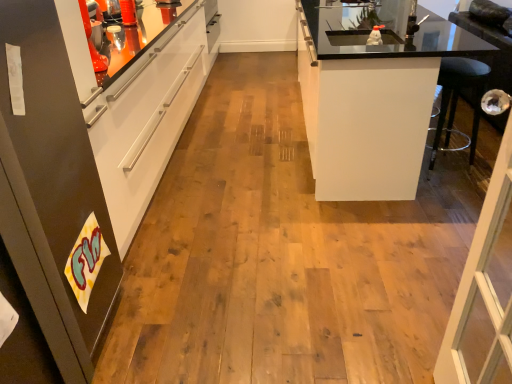
Question: From the image's perspective, would you say matte black refrigerator at left, arranged as the second cabinetry when viewed from the right, is shown under white glossy cabinet at right, the second cabinetry from the front?

Choices:
 (A) yes
 (B) no

Answer: (A)

Question: Does matte black refrigerator at left, arranged as the first cabinetry when viewed from the front, turn towards white glossy cabinet at right, which is the second cabinetry in left-to-right order?

Choices:
 (A) no
 (B) yes

Answer: (A)

Question: Is matte black refrigerator at left, arranged as the first cabinetry when viewed from the front, to the right of white glossy cabinet at right, the second cabinetry from the front, from the viewer's perspective?

Choices:
 (A) yes
 (B) no

Answer: (B)

Question: Can you confirm if matte black refrigerator at left, arranged as the second cabinetry when viewed from the right, is thinner than white glossy cabinet at right, which is the 1th cabinetry from right to left?

Choices:
 (A) no
 (B) yes

Answer: (B)

Question: Does matte black refrigerator at left, which is the first cabinetry from left to right, contain white glossy cabinet at right, placed as the first cabinetry when sorted from back to front?

Choices:
 (A) yes
 (B) no

Answer: (B)

Question: Does matte black refrigerator at left, which appears as the 2th cabinetry when viewed from the back, appear on the left side of white glossy cabinet at right, which is the second cabinetry in left-to-right order?

Choices:
 (A) no
 (B) yes

Answer: (B)

Question: Can you confirm if white glossy cabinet at right, which is the second cabinetry in left-to-right order, is wider than matte black refrigerator at left, which is the first cabinetry from left to right?

Choices:
 (A) no
 (B) yes

Answer: (B)

Question: Is there a large distance between white glossy cabinet at right, the second cabinetry from the front, and matte black refrigerator at left, which is the first cabinetry from left to right?

Choices:
 (A) yes
 (B) no

Answer: (A)

Question: From the image's perspective, is white glossy cabinet at right, placed as the first cabinetry when sorted from back to front, over matte black refrigerator at left, arranged as the first cabinetry when viewed from the front?

Choices:
 (A) yes
 (B) no

Answer: (A)

Question: Is white glossy cabinet at right, placed as the first cabinetry when sorted from back to front, at the right side of matte black refrigerator at left, arranged as the second cabinetry when viewed from the right?

Choices:
 (A) yes
 (B) no

Answer: (A)

Question: From a real-world perspective, is white glossy cabinet at right, which is the 1th cabinetry from right to left, over matte black refrigerator at left, arranged as the second cabinetry when viewed from the right?

Choices:
 (A) yes
 (B) no

Answer: (B)

Question: Is white glossy cabinet at right, which is the 1th cabinetry from right to left, positioned beyond the bounds of matte black refrigerator at left, which is the first cabinetry from left to right?

Choices:
 (A) yes
 (B) no

Answer: (A)

Question: Looking at their shapes, would you say matte black refrigerator at left, arranged as the first cabinetry when viewed from the front, is wider or thinner than white glossy cabinet at right, placed as the first cabinetry when sorted from back to front?

Choices:
 (A) wide
 (B) thin

Answer: (B)